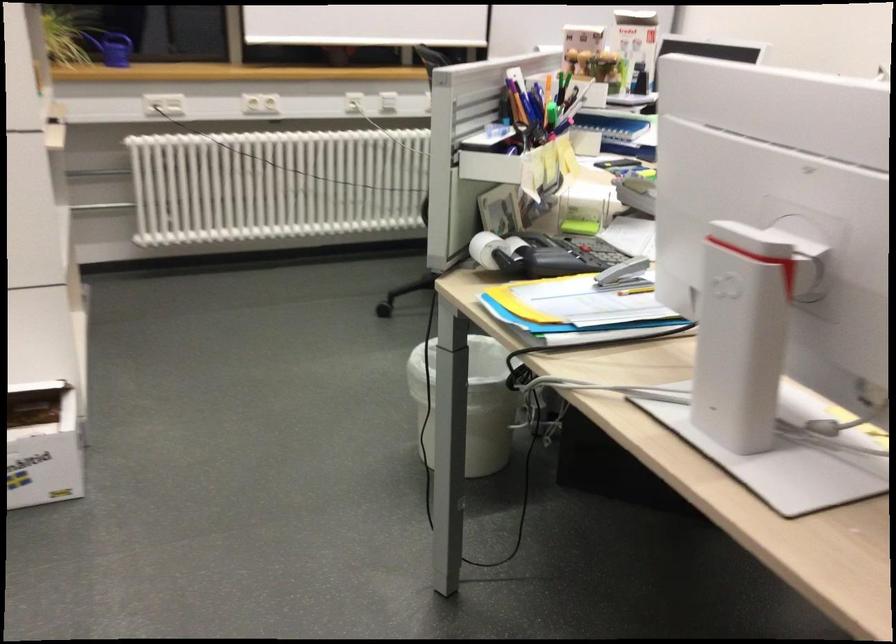
Where would you lift the blue paper folder? Please return your answer as a coordinate pair (x, y).

(662, 574)